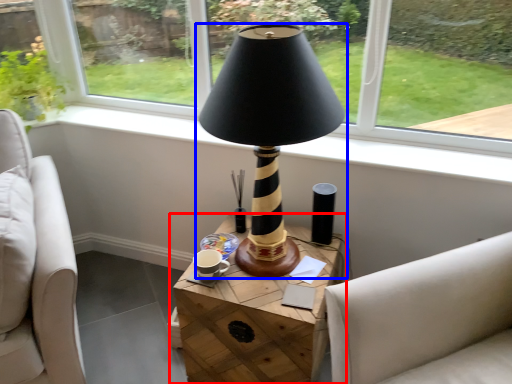
Question: Which object is further to the camera taking this photo, table (highlighted by a red box) or lamp (highlighted by a blue box)?

Choices:
 (A) table
 (B) lamp

Answer: (A)